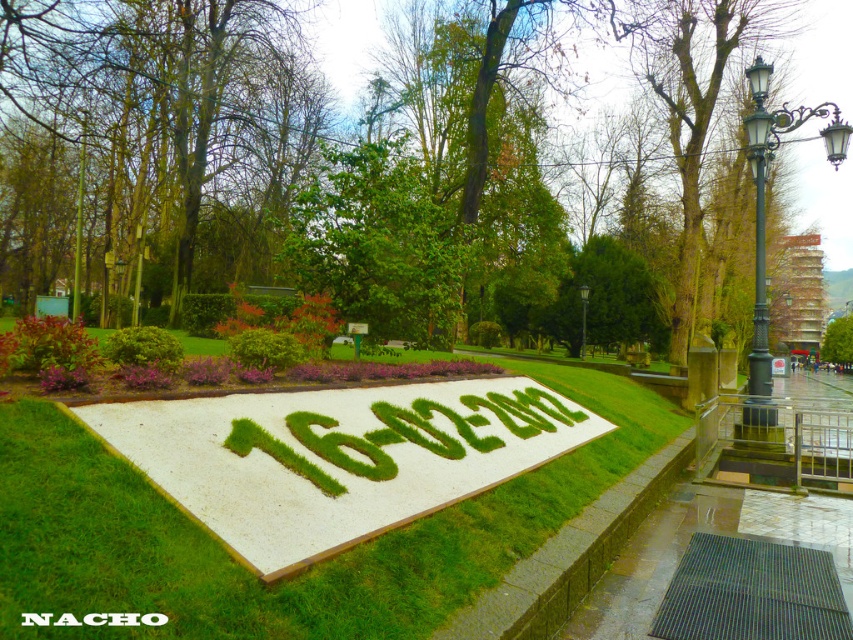
Who is more forward, (x=537, y=540) or (x=757, y=337)?

Point (x=537, y=540) is in front.

Which is more to the right, green grass at center or black metal streetlight at right?

Positioned to the right is black metal streetlight at right.

Does point (207, 561) come closer to viewer compared to point (755, 332)?

Yes, it is in front of point (755, 332).

Where is `green grass at center`? Image resolution: width=853 pixels, height=640 pixels. green grass at center is located at coordinates (300, 573).

Can you confirm if green leafy bush at upper left is taller than black metal lamp post at upper center?

No.

Which is behind, point (24, 342) or point (578, 288)?

The point (578, 288) is more distant.

Identify the location of green leafy bush at upper left. pos(54,344).

Is vivid red leaves at center wider than green leafy bush at upper left?

→ Yes.

What do you see at coordinates (285, 317) in the screenshot?
I see `vivid red leaves at center` at bounding box center [285, 317].

Between point (248, 296) and point (61, 360), which one is positioned behind?

The point (248, 296) is behind.

This screenshot has width=853, height=640. I want to click on vivid red leaves at center, so click(285, 317).